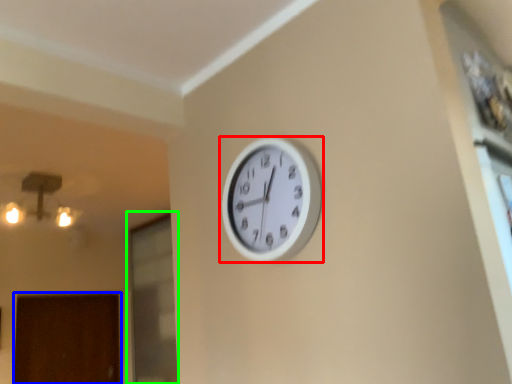
Question: Which is nearer to the wall clock (highlighted by a red box)? door (highlighted by a blue box) or glass door (highlighted by a green box).

Choices:
 (A) door
 (B) glass door

Answer: (B)